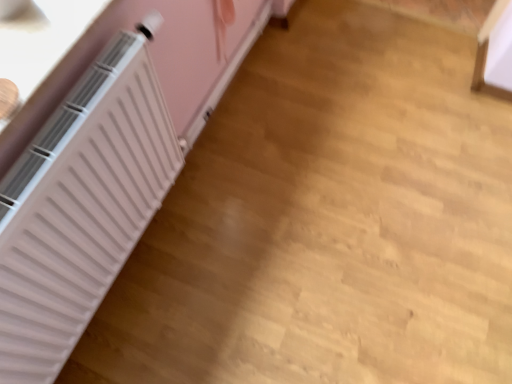
What is the approximate width of white matte radiator at left?

The width of white matte radiator at left is 3.25 inches.

Where is `white matte radiator at left`? This screenshot has width=512, height=384. white matte radiator at left is located at coordinates (80, 207).

Describe the element at coordinates (80, 207) in the screenshot. I see `white matte radiator at left` at that location.

Locate an element on the screen. The image size is (512, 384). white matte radiator at left is located at coordinates (80, 207).